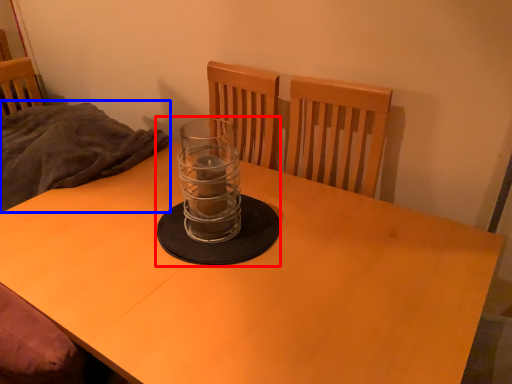
Question: Which object appears closest to the camera in this image, candle holder (highlighted by a red box) or blanket (highlighted by a blue box)?

Choices:
 (A) candle holder
 (B) blanket

Answer: (A)